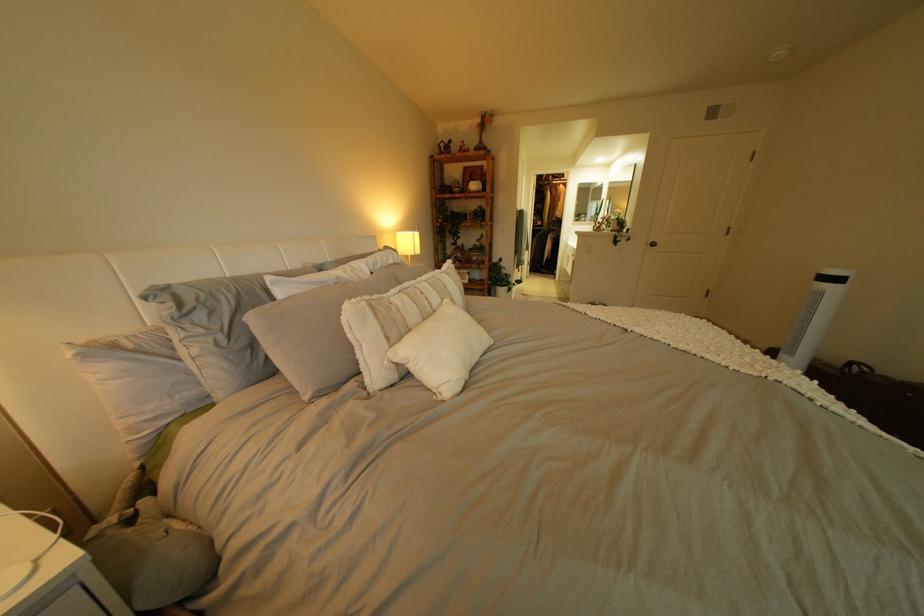
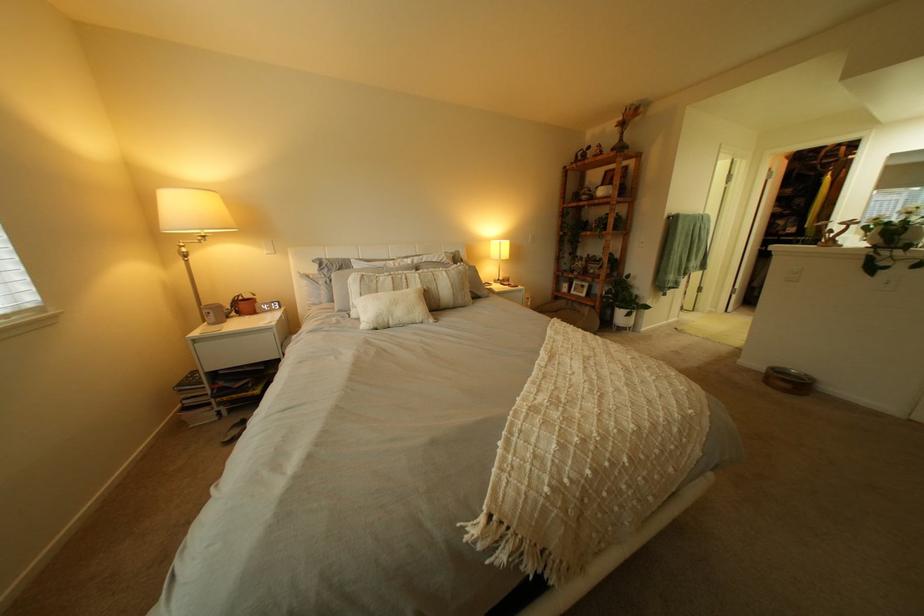
Where in the second image is the point corresponding to (x=723, y=358) from the first image?

(541, 387)